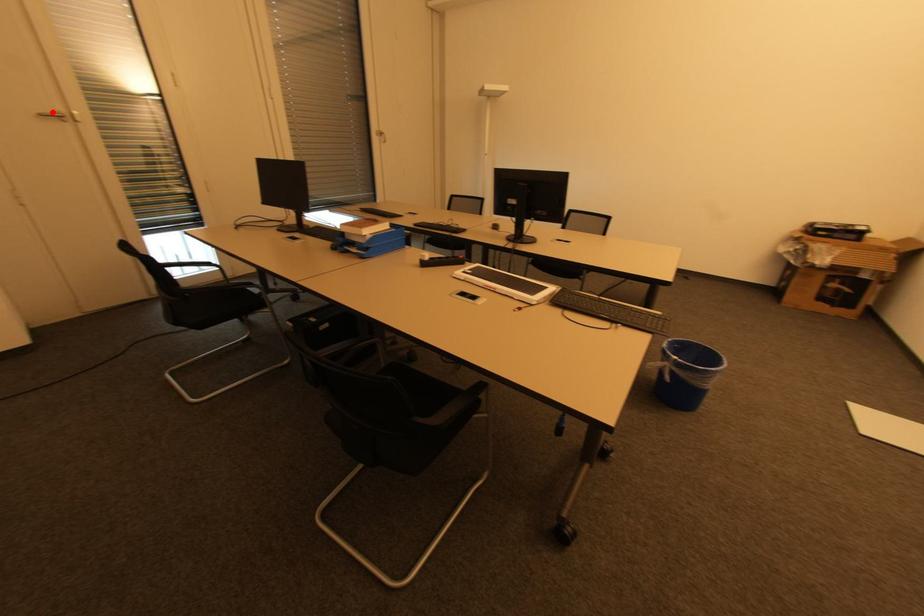
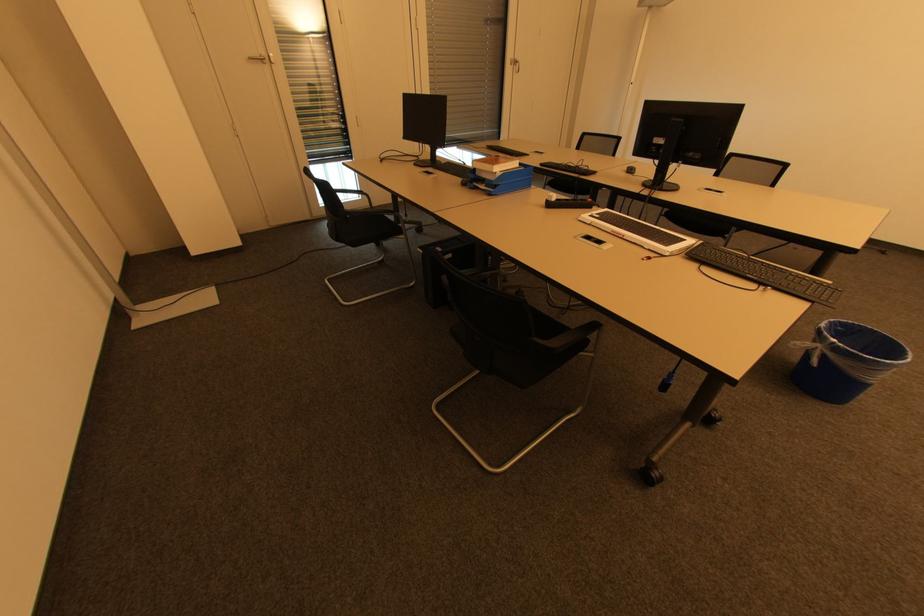
Question: A red point is marked in image1. In image2, is the corresponding 3D point closer to the camera or farther? Reply with the corresponding letter.

Choices:
 (A) The corresponding 3D point is closer.
 (B) The corresponding 3D point is farther.

Answer: (A)